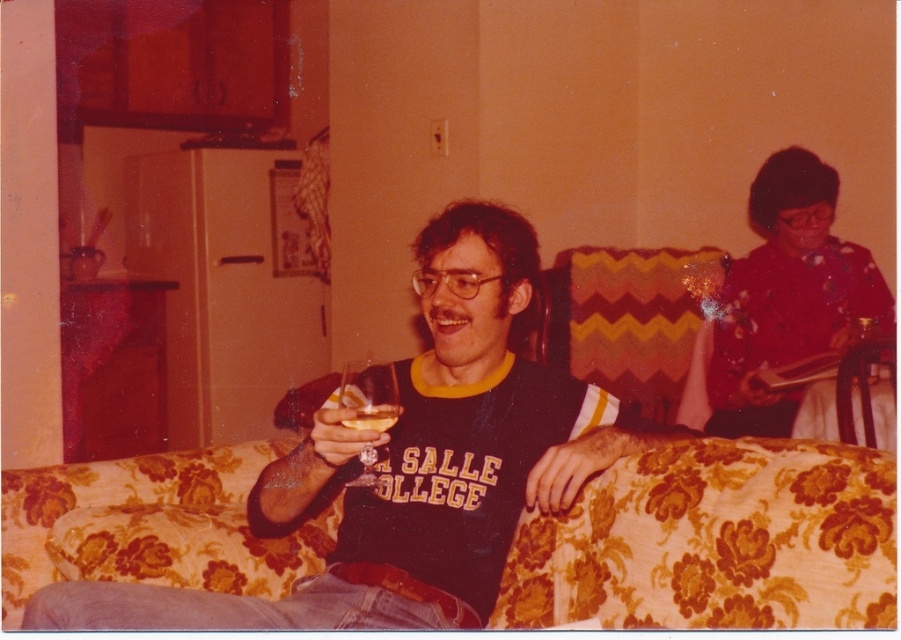
Is clear glass wine glass at center wider than translucent glass at center?

Yes.

Is clear glass wine glass at center taller than translucent glass at center?

Correct, clear glass wine glass at center is much taller as translucent glass at center.

Is point (359, 378) more distant than point (392, 404)?

Yes, it is behind point (392, 404).

Identify the location of clear glass wine glass at center. (369, 396).

Does black matte t-shirt at center have a larger size compared to clear glass wine glass at center?

Yes, black matte t-shirt at center is bigger than clear glass wine glass at center.

Does black matte t-shirt at center have a greater width compared to clear glass wine glass at center?

Indeed, black matte t-shirt at center has a greater width compared to clear glass wine glass at center.

Describe the element at coordinates (454, 426) in the screenshot. The width and height of the screenshot is (901, 640). I see `black matte t-shirt at center` at that location.

This screenshot has width=901, height=640. I want to click on black matte t-shirt at center, so click(454, 426).

Measure the distance from black matte t-shirt at center to translucent glass at center.

A distance of 12.07 inches exists between black matte t-shirt at center and translucent glass at center.

Is black matte t-shirt at center above translucent glass at center?

No.

Where is `black matte t-shirt at center`? Image resolution: width=901 pixels, height=640 pixels. black matte t-shirt at center is located at coordinates (454, 426).